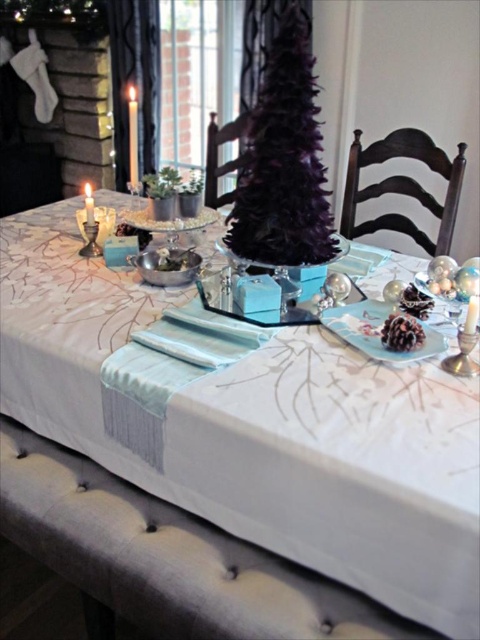
Question: Which object appears closest to the camera in this image?

Choices:
 (A) matte white candle at upper left
 (B) matte silver candle at center

Answer: (B)

Question: Is matte white candle at upper left to the left of matte silver candle at center from the viewer's perspective?

Choices:
 (A) yes
 (B) no

Answer: (B)

Question: Considering the real-world distances, which object is closest to the white satin tablecloth at center?

Choices:
 (A) matte silver candle at center
 (B) matte white candle at upper left

Answer: (A)

Question: Based on their relative distances, which object is nearer to the matte silver candle at center?

Choices:
 (A) matte white candle at upper left
 (B) white satin tablecloth at center

Answer: (A)

Question: In this image, where is matte white candle at upper left located relative to matte silver candle at center?

Choices:
 (A) below
 (B) above

Answer: (B)

Question: Observing the image, what is the correct spatial positioning of matte white candle at upper left in reference to matte silver candle at center?

Choices:
 (A) below
 (B) above

Answer: (B)